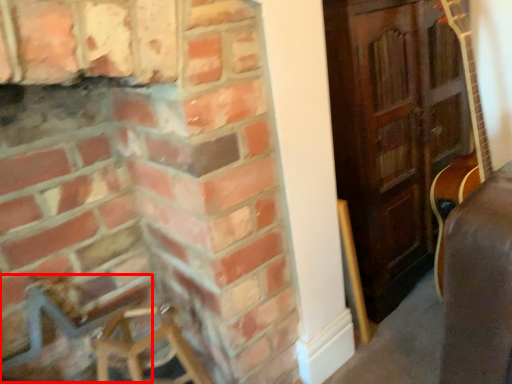
Question: In this image, where is armchair (annotated by the red box) located relative to fireplace?

Choices:
 (A) left
 (B) right

Answer: (A)